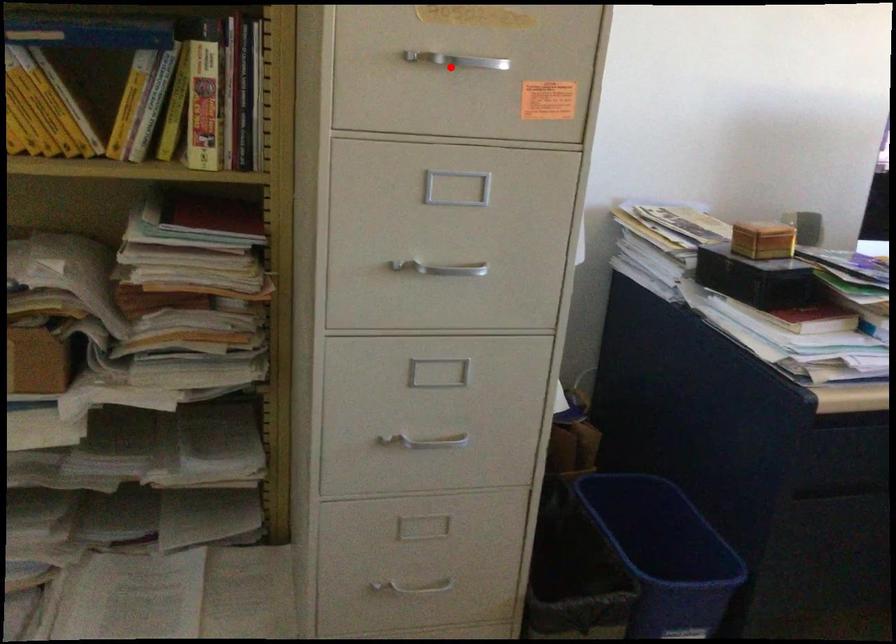
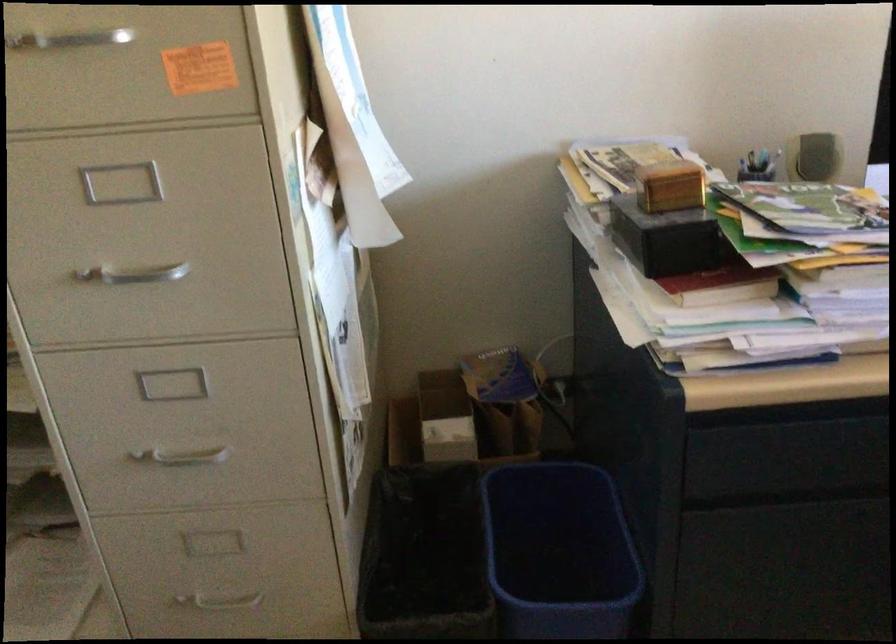
Question: I am providing you with two images of the same scene from different viewpoints. In image1, a red point is highlighted. Considering the same 3D point in image2, which of the following is correct?

Choices:
 (A) It is closer
 (B) It is farther

Answer: (A)